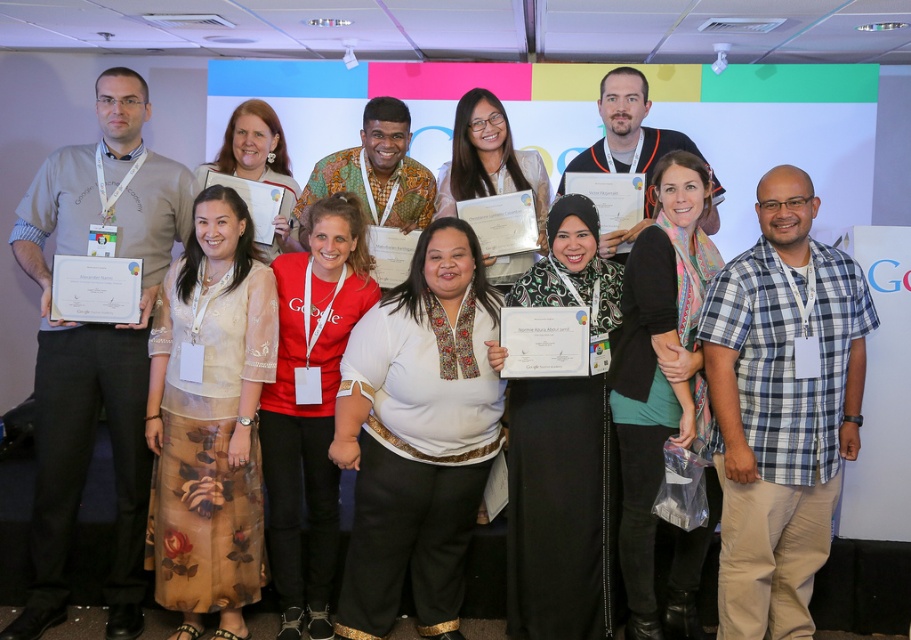
Between translucent floral dress at center and red matte shirt at center, which one appears on the left side from the viewer's perspective?

From the viewer's perspective, translucent floral dress at center appears more on the left side.

Which is in front, point (251, 262) or point (304, 413)?

Point (251, 262) is in front.

Where is `translucent floral dress at center`? The width and height of the screenshot is (911, 640). translucent floral dress at center is located at coordinates [210, 417].

Is black matte scarf at center below red matte shirt at center?

No.

Consider the image. Is black matte scarf at center smaller than red matte shirt at center?

No.

Is point (698, 412) positioned behind point (310, 362)?

That is False.

I want to click on black matte scarf at center, so click(x=662, y=392).

Is black matte scarf at center to the left of matte black shirt at center from the viewer's perspective?

In fact, black matte scarf at center is to the right of matte black shirt at center.

Does point (691, 378) come farther from viewer compared to point (579, 157)?

That is False.

Does point (697, 308) come behind point (621, 97)?

That is False.

Locate an element on the screen. The height and width of the screenshot is (640, 911). black matte scarf at center is located at coordinates (662, 392).